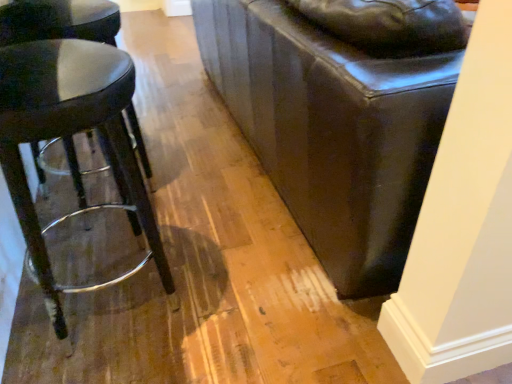
Question: Does matte black stool at left, acting as the first stool starting from the back, have a greater height compared to matte black stool at left, the second stool viewed from the back?

Choices:
 (A) yes
 (B) no

Answer: (A)

Question: Is matte black stool at left, positioned as the second stool in front-to-back order, far from matte black stool at left, marked as the first stool in a front-to-back arrangement?

Choices:
 (A) yes
 (B) no

Answer: (B)

Question: Is matte black stool at left, acting as the first stool starting from the back, beside matte black stool at left, the second stool viewed from the back?

Choices:
 (A) no
 (B) yes

Answer: (A)

Question: Is matte black stool at left, positioned as the second stool in front-to-back order, positioned with its back to matte black stool at left, marked as the first stool in a front-to-back arrangement?

Choices:
 (A) yes
 (B) no

Answer: (B)

Question: Is matte black stool at left, positioned as the second stool in front-to-back order, further to camera compared to matte black stool at left, marked as the first stool in a front-to-back arrangement?

Choices:
 (A) yes
 (B) no

Answer: (A)

Question: Can you confirm if matte black stool at left, positioned as the second stool in front-to-back order, is bigger than matte black stool at left, the second stool viewed from the back?

Choices:
 (A) no
 (B) yes

Answer: (B)

Question: Considering the relative sizes of matte black stool at left, marked as the first stool in a front-to-back arrangement, and matte black stool at left, positioned as the second stool in front-to-back order, in the image provided, is matte black stool at left, marked as the first stool in a front-to-back arrangement, smaller than matte black stool at left, positioned as the second stool in front-to-back order,?

Choices:
 (A) yes
 (B) no

Answer: (A)

Question: Considering the relative sizes of matte black stool at left, the second stool viewed from the back, and matte black stool at left, positioned as the second stool in front-to-back order, in the image provided, is matte black stool at left, the second stool viewed from the back, bigger than matte black stool at left, positioned as the second stool in front-to-back order,?

Choices:
 (A) yes
 (B) no

Answer: (B)

Question: From the image's perspective, is matte black stool at left, the second stool viewed from the back, under matte black stool at left, positioned as the second stool in front-to-back order?

Choices:
 (A) yes
 (B) no

Answer: (A)

Question: Is matte black stool at left, marked as the first stool in a front-to-back arrangement, oriented away from matte black stool at left, acting as the first stool starting from the back?

Choices:
 (A) no
 (B) yes

Answer: (A)

Question: From the image's perspective, is matte black stool at left, the second stool viewed from the back, on matte black stool at left, acting as the first stool starting from the back?

Choices:
 (A) yes
 (B) no

Answer: (B)

Question: Is matte black stool at left, the second stool viewed from the back, closer to the viewer compared to matte black stool at left, acting as the first stool starting from the back?

Choices:
 (A) yes
 (B) no

Answer: (A)

Question: In terms of height, does matte black stool at left, marked as the first stool in a front-to-back arrangement, look taller or shorter compared to matte black stool at left, acting as the first stool starting from the back?

Choices:
 (A) short
 (B) tall

Answer: (A)